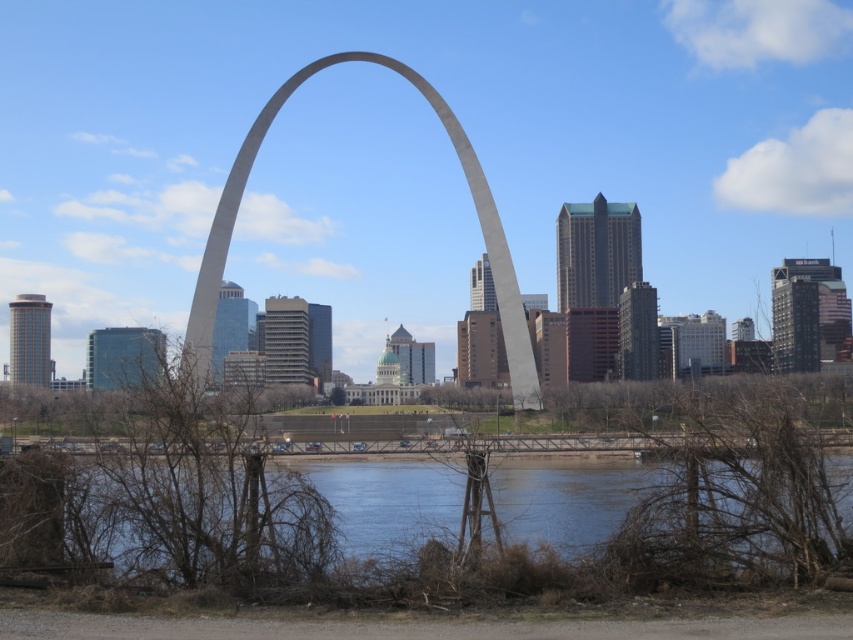
Who is more distant from viewer, (563,544) or (479,168)?

The point (479,168) is behind.

Does clear water at lower center have a lesser width compared to gray concrete arch at center?

In fact, clear water at lower center might be wider than gray concrete arch at center.

What do you see at coordinates (389, 500) in the screenshot? I see `clear water at lower center` at bounding box center [389, 500].

Find the location of `clear water at lower center`. clear water at lower center is located at coordinates (389, 500).